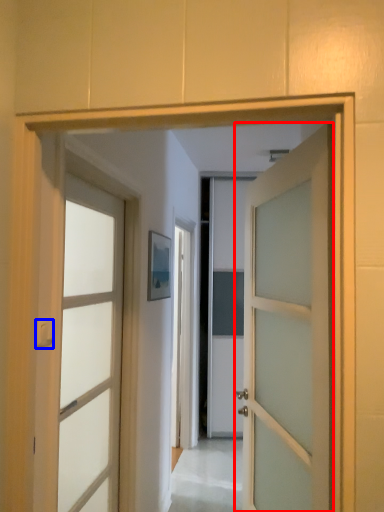
Question: Which object is further to the camera taking this photo, door (highlighted by a red box) or door handle (highlighted by a blue box)?

Choices:
 (A) door
 (B) door handle

Answer: (B)